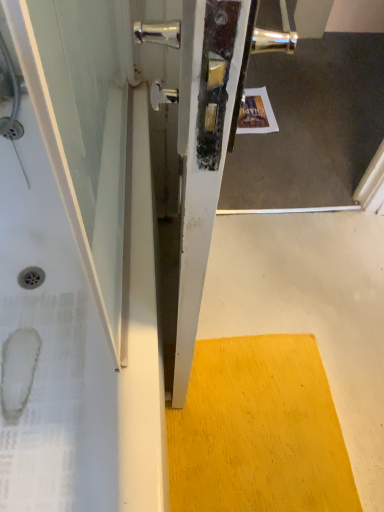
Locate an element on the screen. The width and height of the screenshot is (384, 512). white glossy bathtub at left is located at coordinates (64, 252).

What is the approximate height of white glossy bathtub at left?

It is 22.70 inches.

The width and height of the screenshot is (384, 512). What do you see at coordinates (64, 252) in the screenshot?
I see `white glossy bathtub at left` at bounding box center [64, 252].

What is the approximate height of yellow textured mat at lower center?

It is 1.68 inches.

What do you see at coordinates (258, 431) in the screenshot?
I see `yellow textured mat at lower center` at bounding box center [258, 431].

Identify the location of yellow textured mat at lower center. (258, 431).

This screenshot has width=384, height=512. I want to click on white glossy bathtub at left, so click(64, 252).

Visually, is white glossy bathtub at left positioned to the left or to the right of yellow textured mat at lower center?

From the image, it's evident that white glossy bathtub at left is to the left of yellow textured mat at lower center.

Based on the photo, is white glossy bathtub at left closer to the viewer compared to yellow textured mat at lower center?

Yes, white glossy bathtub at left is in front of yellow textured mat at lower center.

Which is further, (26, 96) or (311, 419)?

The point (311, 419) is behind.

From the image's perspective, is white glossy bathtub at left below yellow textured mat at lower center?

No.

From the picture: From a real-world perspective, which object stands above the other?

white glossy bathtub at left, from a real-world perspective.

Which of these two, white glossy bathtub at left or yellow textured mat at lower center, is thinner?

With smaller width is yellow textured mat at lower center.

From their relative heights in the image, would you say white glossy bathtub at left is taller or shorter than yellow textured mat at lower center?

Considering their sizes, white glossy bathtub at left has more height than yellow textured mat at lower center.

Does white glossy bathtub at left have a smaller size compared to yellow textured mat at lower center?

Incorrect, white glossy bathtub at left is not smaller in size than yellow textured mat at lower center.

Would you say yellow textured mat at lower center is part of white glossy bathtub at left's contents?

No, white glossy bathtub at left does not contain yellow textured mat at lower center.

Is the surface of white glossy bathtub at left in direct contact with yellow textured mat at lower center?

They are not placed beside each other.

Is white glossy bathtub at left positioned with its back to yellow textured mat at lower center?

No, white glossy bathtub at left is not facing the opposite direction of yellow textured mat at lower center.

How many degrees apart are the facing directions of white glossy bathtub at left and yellow textured mat at lower center?

91.8 degrees separate the facing orientations of white glossy bathtub at left and yellow textured mat at lower center.

Find the location of `bath on the left side of yellow textured mat at lower center`. bath on the left side of yellow textured mat at lower center is located at coordinates (64, 252).

Is yellow textured mat at lower center to the left or to the right of white glossy bathtub at left in the image?

Clearly, yellow textured mat at lower center is on the right of white glossy bathtub at left in the image.

Is the position of yellow textured mat at lower center less distant than that of white glossy bathtub at left?

No, it is not.

Considering the positions of point (174, 478) and point (99, 258), is point (174, 478) closer or farther from the camera than point (99, 258)?

Point (174, 478) is farther from the camera than point (99, 258).

From the image's perspective, is yellow textured mat at lower center below white glossy bathtub at left?

Correct, yellow textured mat at lower center appears lower than white glossy bathtub at left in the image.

From a real-world perspective, is yellow textured mat at lower center beneath white glossy bathtub at left?

Yes, from a real-world perspective, yellow textured mat at lower center is under white glossy bathtub at left.

Which object is wider, yellow textured mat at lower center or white glossy bathtub at left?

With larger width is white glossy bathtub at left.

Is yellow textured mat at lower center shorter than white glossy bathtub at left?

Indeed, yellow textured mat at lower center has a lesser height compared to white glossy bathtub at left.

Can you confirm if yellow textured mat at lower center is smaller than white glossy bathtub at left?

Yes, yellow textured mat at lower center is smaller than white glossy bathtub at left.

Is yellow textured mat at lower center positioned beyond the bounds of white glossy bathtub at left?

Absolutely, yellow textured mat at lower center is external to white glossy bathtub at left.

Can you see yellow textured mat at lower center touching white glossy bathtub at left?

No, yellow textured mat at lower center is not touching white glossy bathtub at left.

Does yellow textured mat at lower center turn towards white glossy bathtub at left?

No, yellow textured mat at lower center is not turned towards white glossy bathtub at left.

Can you tell me how much yellow textured mat at lower center and white glossy bathtub at left differ in facing direction?

The angular difference between yellow textured mat at lower center and white glossy bathtub at left is 91.8 degrees.

Where is `doormat behind the white glossy bathtub at left`? The image size is (384, 512). doormat behind the white glossy bathtub at left is located at coordinates (258, 431).

Where is `doormat below the white glossy bathtub at left (from a real-world perspective)`? Image resolution: width=384 pixels, height=512 pixels. doormat below the white glossy bathtub at left (from a real-world perspective) is located at coordinates (258, 431).

Where is `doormat behind the white glossy bathtub at left`? The height and width of the screenshot is (512, 384). doormat behind the white glossy bathtub at left is located at coordinates (258, 431).